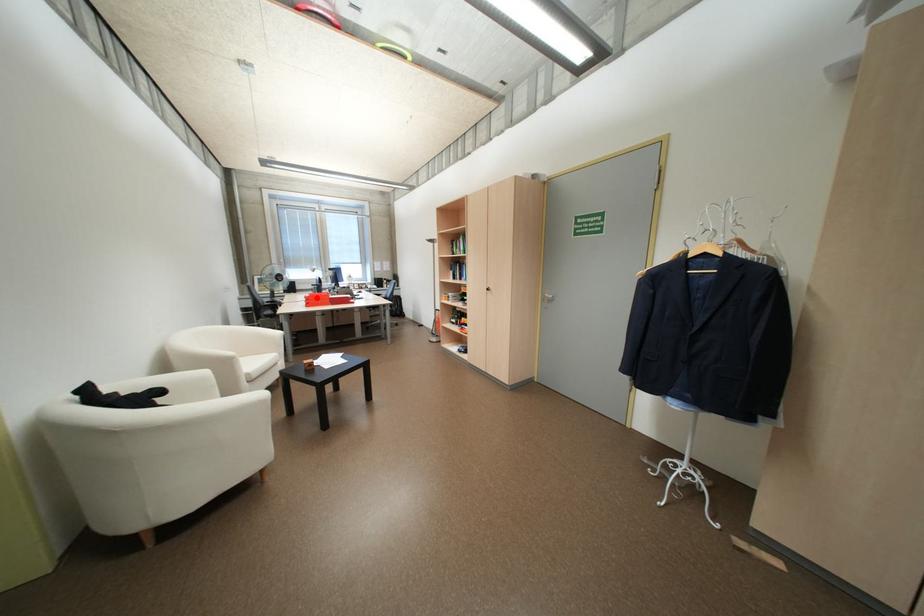
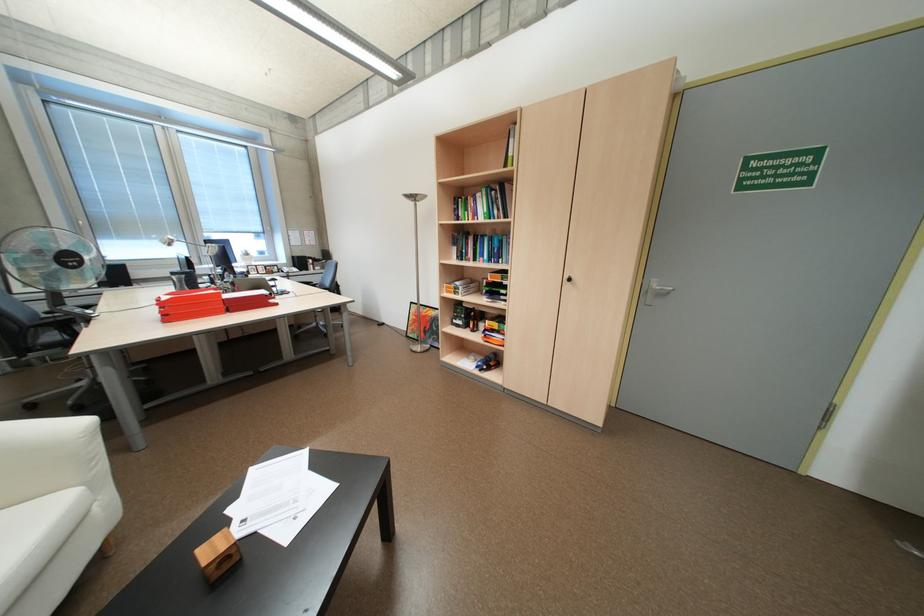
In the second image, find the point that corresponds to the highlighted location in the first image.

(173, 304)